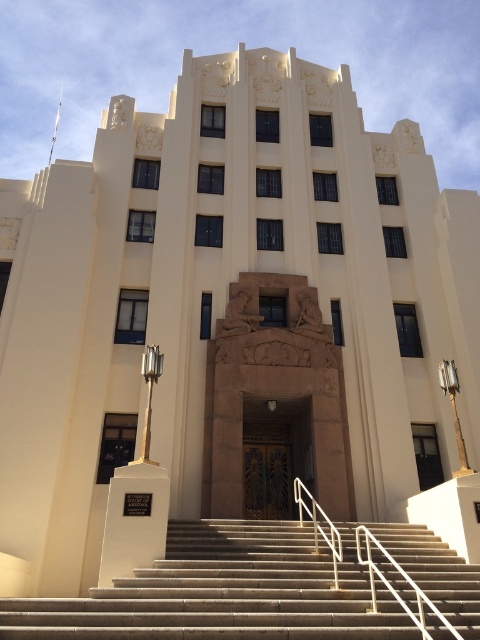
You are a visitor arriving at the building and need to enter through the brown wood door at center. There is a white marble monument at lower center in your way. Can you walk around the monument to reach the door?

The brown wood door at center occupies less space than white marble monument at lower center, so the monument is larger. You can walk around the monument to reach the door since it is possible to navigate around it despite its size.

You are a delivery person needing to park your 1.2 meter wide van. You see the concrete stairs at center and the white marble monument at lower center in front of the building. Which object has enough space for your van to park next to it without overlapping?

The concrete stairs at center have a width greater than the white marble monument at lower center, so the van can park next to the concrete stairs at center as it provides sufficient space.

Looking at this image, you are a delivery person carrying a heavy package and need to reach the brown wood door at center. The concrete stairs at center are in your way. Can you walk around them to reach the door without climbing the stairs?

The distance between the concrete stairs at center and the brown wood door at center is 10.57 meters. Since the stairs are in front of the door, you can walk around them to reach the door without climbing, as there is enough space between them and the door.